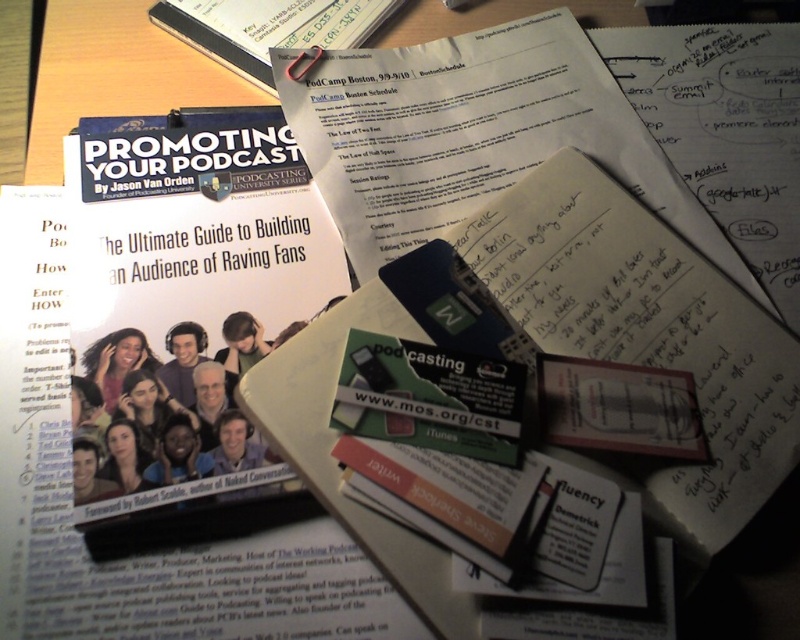
Between point (632, 168) and point (341, 12), which one is positioned in front?

Point (632, 168) is in front.

Can you confirm if white paper at center is taller than matte black book at upper center?

Indeed, white paper at center has a greater height compared to matte black book at upper center.

This screenshot has height=640, width=800. What are the coordinates of `white paper at center` in the screenshot? It's located at (494, 140).